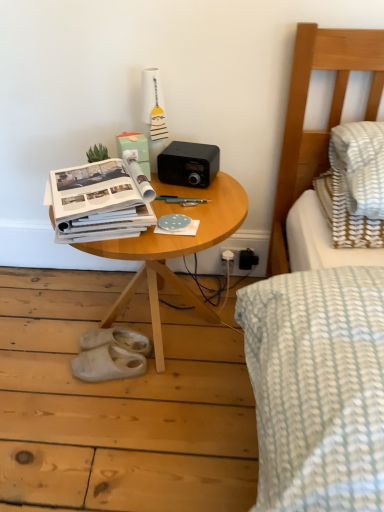
Question: Is white rubber slippers at lower left, the 1th footwear in the front-to-back sequence, oriented towards wooden table at center?

Choices:
 (A) no
 (B) yes

Answer: (B)

Question: From a real-world perspective, is white rubber slippers at lower left, the second footwear when ordered from back to front, located higher than wooden table at center?

Choices:
 (A) no
 (B) yes

Answer: (A)

Question: Can you confirm if white rubber slippers at lower left, the 1th footwear in the front-to-back sequence, is wider than wooden table at center?

Choices:
 (A) yes
 (B) no

Answer: (B)

Question: Does white rubber slippers at lower left, the 1th footwear in the front-to-back sequence, have a greater height compared to wooden table at center?

Choices:
 (A) no
 (B) yes

Answer: (A)

Question: Does white rubber slippers at lower left, the 1th footwear in the front-to-back sequence, have a lesser height compared to wooden table at center?

Choices:
 (A) yes
 (B) no

Answer: (A)

Question: Is point (97, 330) closer or farther from the camera than point (99, 352)?

Choices:
 (A) closer
 (B) farther

Answer: (B)

Question: In terms of height, does white rubber sandals at lower left, the second footwear in the front-to-back sequence, look taller or shorter compared to white rubber slippers at lower left, the second footwear when ordered from back to front?

Choices:
 (A) short
 (B) tall

Answer: (B)

Question: Is white rubber sandals at lower left, acting as the first footwear starting from the back, in front of or behind white rubber slippers at lower left, the 1th footwear in the front-to-back sequence, in the image?

Choices:
 (A) behind
 (B) front

Answer: (A)

Question: From the image's perspective, is white rubber sandals at lower left, the second footwear in the front-to-back sequence, located above or below white rubber slippers at lower left, the second footwear when ordered from back to front?

Choices:
 (A) below
 (B) above

Answer: (B)

Question: In the image, is white rubber slippers at lower left, the 1th footwear in the front-to-back sequence, positioned in front of or behind white rubber sandals at lower left, the second footwear in the front-to-back sequence?

Choices:
 (A) behind
 (B) front

Answer: (B)

Question: Is white rubber slippers at lower left, the second footwear when ordered from back to front, taller or shorter than white rubber sandals at lower left, the second footwear in the front-to-back sequence?

Choices:
 (A) tall
 (B) short

Answer: (B)

Question: Considering the positions of point (137, 362) and point (137, 345), is point (137, 362) closer or farther from the camera than point (137, 345)?

Choices:
 (A) closer
 (B) farther

Answer: (A)

Question: Is white rubber slippers at lower left, the second footwear when ordered from back to front, inside or outside of white rubber sandals at lower left, acting as the first footwear starting from the back?

Choices:
 (A) outside
 (B) inside

Answer: (A)

Question: Considering the positions of point (210, 208) and point (104, 334), is point (210, 208) closer or farther from the camera than point (104, 334)?

Choices:
 (A) closer
 (B) farther

Answer: (A)

Question: Is wooden table at center to the left or to the right of white rubber sandals at lower left, acting as the first footwear starting from the back, in the image?

Choices:
 (A) left
 (B) right

Answer: (B)